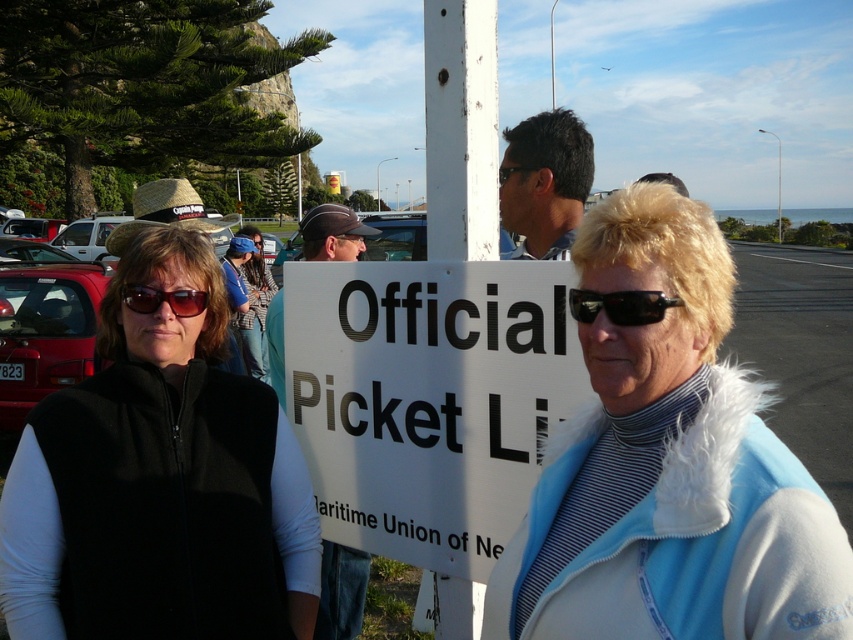
Who is more distant from viewer, (550, 125) or (338, 237)?

Point (338, 237)

Does dark brown hair at upper center have a larger size compared to black plastic goggles at center?

Yes.

What do you see at coordinates (544, 180) in the screenshot? This screenshot has width=853, height=640. I see `dark brown hair at upper center` at bounding box center [544, 180].

This screenshot has width=853, height=640. I want to click on dark brown hair at upper center, so click(544, 180).

Who is lower down, blue fleece vest at center or black fleece vest at center?

Positioned lower is black fleece vest at center.

Is point (619, 212) in front of point (215, 291)?

That is True.

Image resolution: width=853 pixels, height=640 pixels. Describe the element at coordinates (669, 467) in the screenshot. I see `blue fleece vest at center` at that location.

Find the location of a particular element. Image resolution: width=853 pixels, height=640 pixels. blue fleece vest at center is located at coordinates (669, 467).

Is matte black cap at center further to the viewer compared to black plastic goggles at center?

No, it is not.

Is point (323, 618) positioned before point (363, 241)?

Yes, point (323, 618) is in front of point (363, 241).

The width and height of the screenshot is (853, 640). I want to click on matte black cap at center, so click(x=341, y=592).